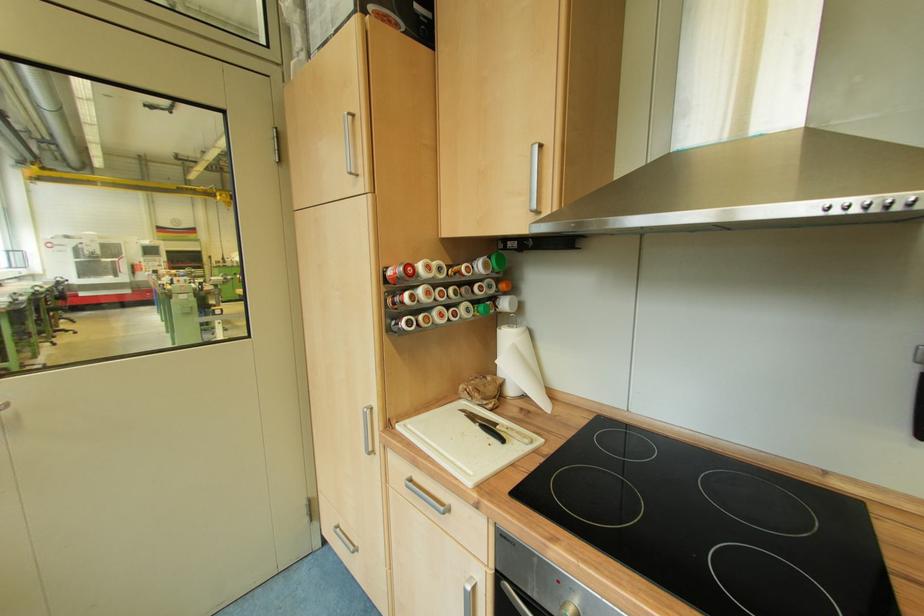
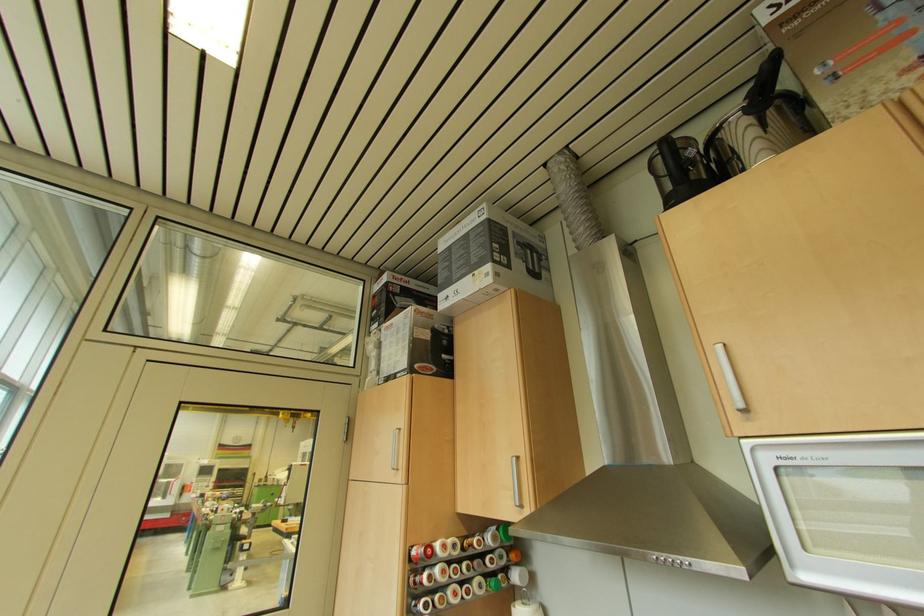
In the second image, find the point that corresponds to (x=454, y=236) in the first image.

(468, 513)